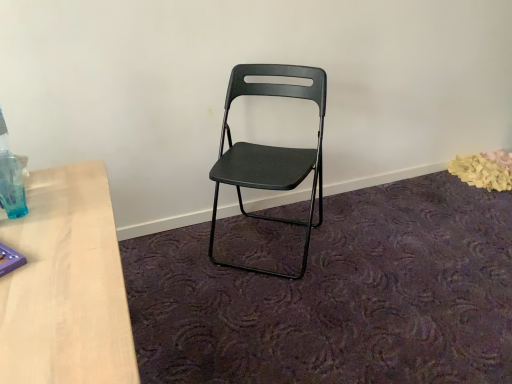
What do you see at coordinates (10, 178) in the screenshot? The image size is (512, 384). I see `translucent blue plastic bottle at left` at bounding box center [10, 178].

This screenshot has height=384, width=512. In order to click on translucent blue plastic bottle at left in this screenshot , I will do `click(10, 178)`.

The width and height of the screenshot is (512, 384). In order to click on matte black folding chair at center in this screenshot , I will do `click(270, 151)`.

What is the approximate width of matte black folding chair at center?

It is 19.47 inches.

What do you see at coordinates (270, 151) in the screenshot? I see `matte black folding chair at center` at bounding box center [270, 151].

Locate an element on the screen. The image size is (512, 384). translucent blue plastic bottle at left is located at coordinates pos(10,178).

Considering the relative positions of translucent blue plastic bottle at left and matte black folding chair at center in the image provided, is translucent blue plastic bottle at left to the left or to the right of matte black folding chair at center?

Clearly, translucent blue plastic bottle at left is on the left of matte black folding chair at center in the image.

Considering the relative positions of translucent blue plastic bottle at left and matte black folding chair at center in the image provided, is translucent blue plastic bottle at left in front of matte black folding chair at center?

Yes, it is.

Which is behind, point (5, 152) or point (295, 91)?

Point (295, 91)

From the image's perspective, does translucent blue plastic bottle at left appear lower than matte black folding chair at center?

Yes, from the image's perspective, translucent blue plastic bottle at left is below matte black folding chair at center.

From a real-world perspective, between translucent blue plastic bottle at left and matte black folding chair at center, who is vertically higher?

translucent blue plastic bottle at left is physically above.

Considering the sizes of objects translucent blue plastic bottle at left and matte black folding chair at center in the image provided, who is thinner, translucent blue plastic bottle at left or matte black folding chair at center?

Thinner between the two is translucent blue plastic bottle at left.

Which of these two, translucent blue plastic bottle at left or matte black folding chair at center, stands taller?

Standing taller between the two is matte black folding chair at center.

Who is bigger, translucent blue plastic bottle at left or matte black folding chair at center?

matte black folding chair at center is bigger.

Is matte black folding chair at center a part of translucent blue plastic bottle at left?

No, matte black folding chair at center is not surrounded by translucent blue plastic bottle at left.

Is translucent blue plastic bottle at left not close to matte black folding chair at center?

No, translucent blue plastic bottle at left is not far from matte black folding chair at center.

Does translucent blue plastic bottle at left turn towards matte black folding chair at center?

Yes.

What's the angular difference between translucent blue plastic bottle at left and matte black folding chair at center's facing directions?

There is a 127-degree angle between the facing directions of translucent blue plastic bottle at left and matte black folding chair at center.

Identify the location of chair lying on the right of translucent blue plastic bottle at left. (270, 151).

Which object is positioned more to the left, matte black folding chair at center or translucent blue plastic bottle at left?

translucent blue plastic bottle at left.

Is matte black folding chair at center positioned before translucent blue plastic bottle at left?

No, the depth of matte black folding chair at center is greater than that of translucent blue plastic bottle at left.

Which point is more forward, (317,68) or (7,200)?

Positioned in front is point (7,200).

From the image's perspective, is matte black folding chair at center located above translucent blue plastic bottle at left?

Yes.

From a real-world perspective, who is located higher, matte black folding chair at center or translucent blue plastic bottle at left?

In real-world perspective, translucent blue plastic bottle at left is above.

From the picture: Considering the relative sizes of matte black folding chair at center and translucent blue plastic bottle at left in the image provided, is matte black folding chair at center wider than translucent blue plastic bottle at left?

Yes, matte black folding chair at center is wider than translucent blue plastic bottle at left.

Is matte black folding chair at center taller than translucent blue plastic bottle at left?

Correct, matte black folding chair at center is much taller as translucent blue plastic bottle at left.

Considering the relative sizes of matte black folding chair at center and translucent blue plastic bottle at left in the image provided, is matte black folding chair at center smaller than translucent blue plastic bottle at left?

Actually, matte black folding chair at center might be larger than translucent blue plastic bottle at left.

Would you say matte black folding chair at center contains translucent blue plastic bottle at left?

No, translucent blue plastic bottle at left is not a part of matte black folding chair at center.

Can you see matte black folding chair at center touching translucent blue plastic bottle at left?

No, matte black folding chair at center is not in contact with translucent blue plastic bottle at left.

Is matte black folding chair at center facing towards translucent blue plastic bottle at left?

No, matte black folding chair at center is not facing towards translucent blue plastic bottle at left.

What's the angular difference between matte black folding chair at center and translucent blue plastic bottle at left's facing directions?

There is a 127-degree angle between the facing directions of matte black folding chair at center and translucent blue plastic bottle at left.

In order to click on bottle on the left of matte black folding chair at center in this screenshot , I will do `click(10, 178)`.

There is a matte black folding chair at center. At what (x,y) coordinates should I click in order to perform the action: click on bottle above it (from a real-world perspective). Please return your answer as a coordinate pair (x, y). The height and width of the screenshot is (384, 512). Looking at the image, I should click on (10, 178).

I want to click on bottle on the left of the matte black folding chair at center, so click(10, 178).